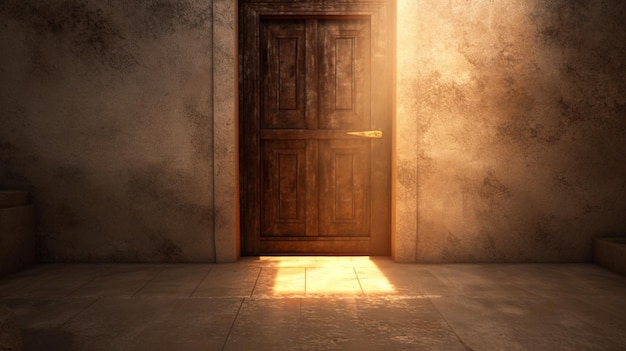
Locate an element on the screen. The height and width of the screenshot is (351, 626). light is located at coordinates (332, 270).